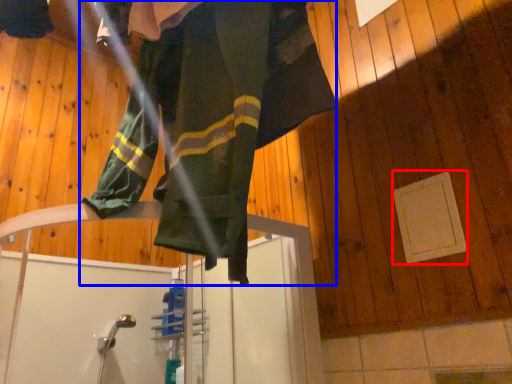
Question: Which of the following is the closest to the observer, panel (highlighted by a red box) or woman (highlighted by a blue box)?

Choices:
 (A) panel
 (B) woman

Answer: (B)